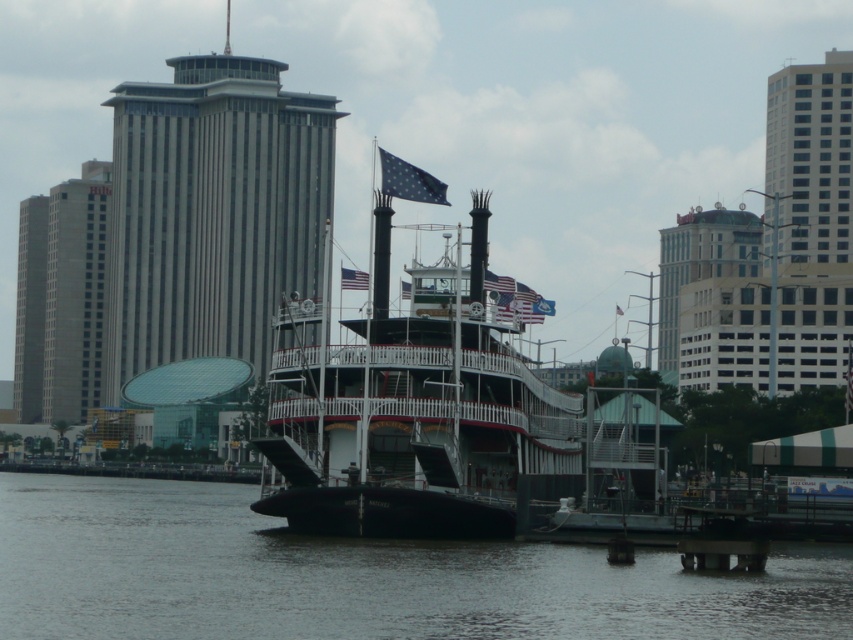
Question: Which object is positioned farthest from the glassy steel skyscraper at upper right?

Choices:
 (A) smooth concrete dock at lower center
 (B) gray glass skyscraper at center

Answer: (A)

Question: Is black water at lower left to the right of smooth concrete dock at lower center from the viewer's perspective?

Choices:
 (A) yes
 (B) no

Answer: (B)

Question: Can you confirm if gray concrete building at left is positioned to the right of gray glass skyscraper at left?

Choices:
 (A) no
 (B) yes

Answer: (B)

Question: Which object is closer to the camera taking this photo?

Choices:
 (A) smooth concrete dock at lower center
 (B) gray concrete building at left
 (C) glassy steel skyscraper at upper right

Answer: (A)

Question: Which object is farther from the camera taking this photo?

Choices:
 (A) glassy steel skyscraper at upper right
 (B) american flag at center

Answer: (A)

Question: Can you confirm if gray concrete building at left is positioned to the right of glassy steel skyscraper at upper right?

Choices:
 (A) no
 (B) yes

Answer: (A)